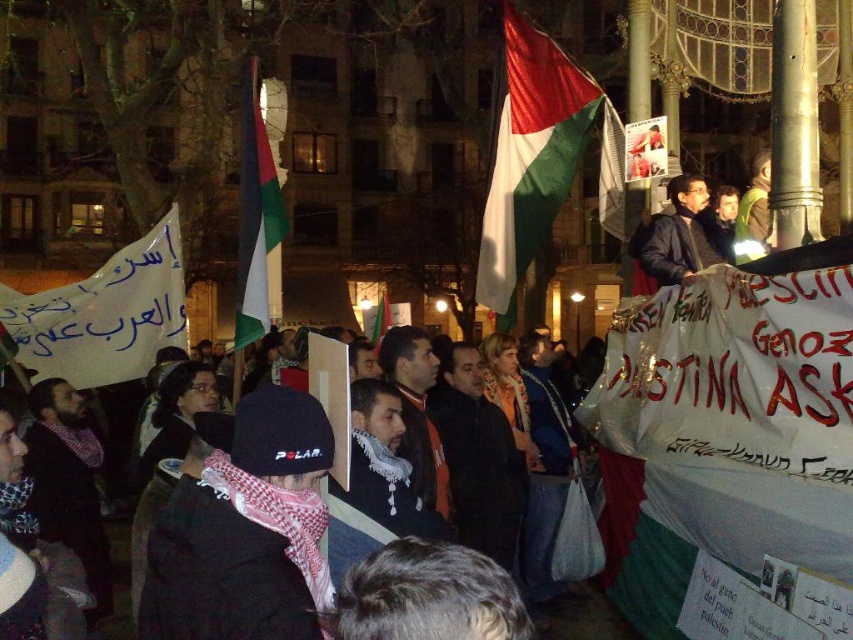
Question: Can you confirm if dark brown leather jacket at upper center is wider than green fabric flag at center?

Choices:
 (A) yes
 (B) no

Answer: (A)

Question: Which object is the closest to the white scarf at center?

Choices:
 (A) white fabric flag at center
 (B) green fabric flag at center
 (C) black fleece jacket at center
 (D) green-white-red fabric flag at center

Answer: (D)

Question: Is white fabric flag at center closer to camera compared to white scarf at center?

Choices:
 (A) no
 (B) yes

Answer: (A)

Question: Is white paper banner at left positioned at the back of dark brown leather jacket at upper center?

Choices:
 (A) yes
 (B) no

Answer: (A)

Question: Which point is farther to the camera?

Choices:
 (A) (558, 177)
 (B) (97, 563)
 (C) (178, 531)

Answer: (A)

Question: Which of these objects is positioned farthest from the white scarf at center?

Choices:
 (A) dark brown leather jacket at upper center
 (B) green fabric flag at center
 (C) black fleece jacket at center
 (D) green-white-red fabric flag at center

Answer: (A)